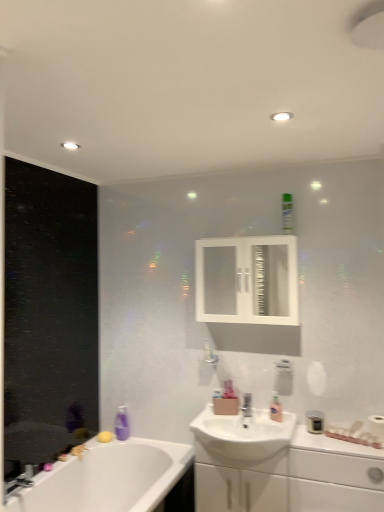
Locate an element on the screen. The height and width of the screenshot is (512, 384). vacant space to the right of satin nickel faucet at sink center, the second tap positioned from the front is located at coordinates (276, 419).